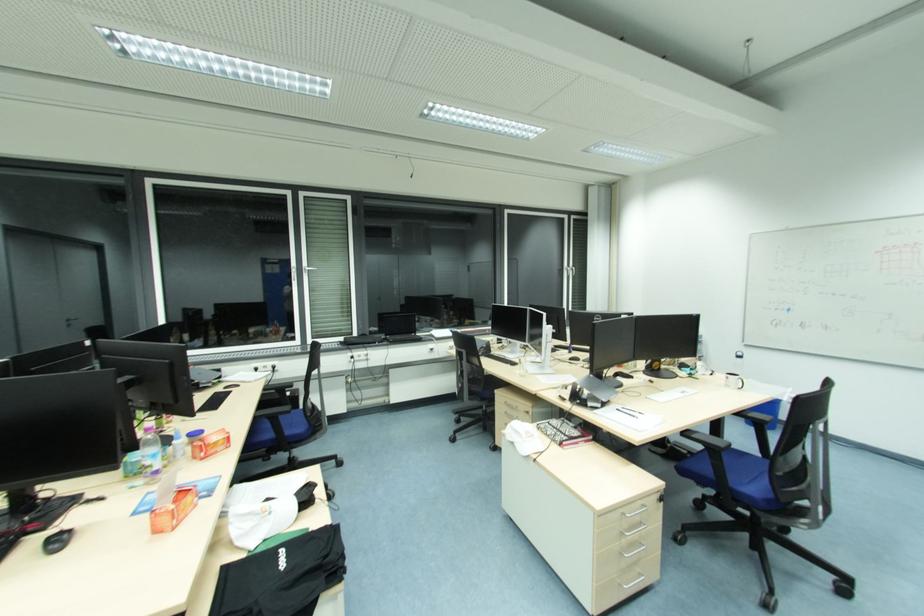
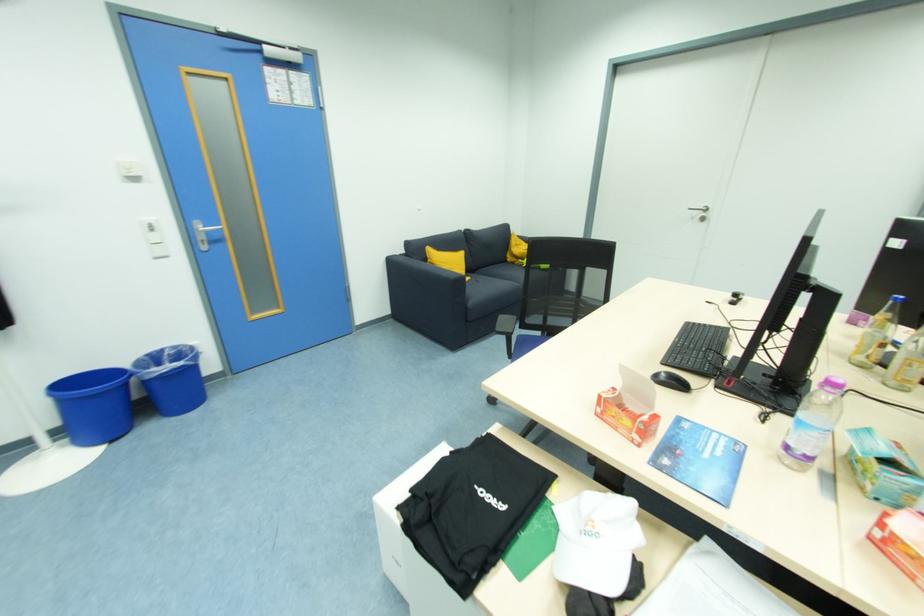
In the second image, find the point that corresponds to [272,538] in the first image.

(563, 535)